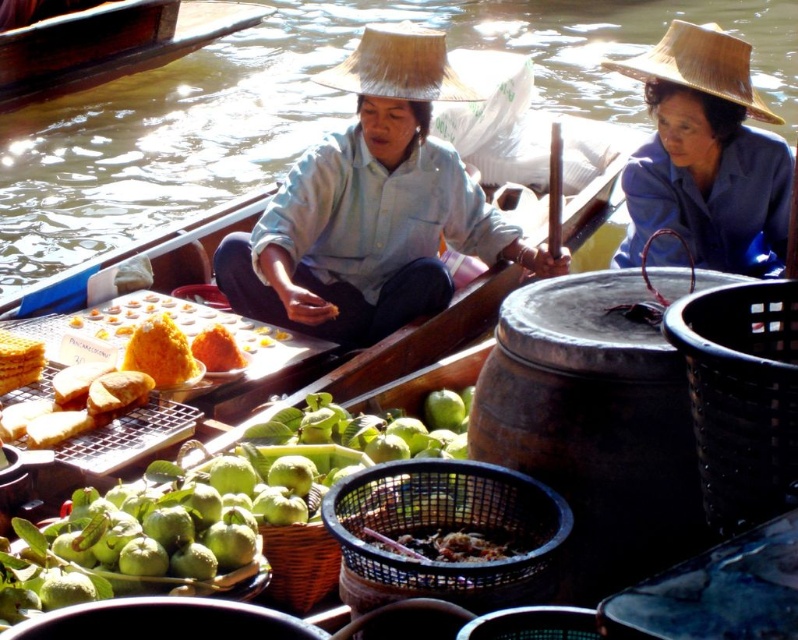
You are standing at the viewer position in the floating market scene. There is a point marked at coordinates point (767, 113). Can you reach that point if you can move 25 feet forward?

The point (767, 113) is 23.85 feet away from the viewer. Since you can move 25 feet forward, you can reach it.

You are a tourist in the floating market and want to buy a souvenir. You see the natural straw hat at upper center and the brown woven basket at center. Which item is positioned higher in the image?

The natural straw hat at upper center is located above the brown woven basket at center, so it is positioned higher in the image.

You are a customer in the floating market and want to buy snacks from the vendor. The vendor is wearing a matte light blue shirt at center and is in a wooden boat at upper left. Which object would you approach first to reach the snacks?

The matte light blue shirt at center is thinner than the wooden boat at upper left, so you should approach the wooden boat at upper left first because it is wider and likely closer to the snacks.